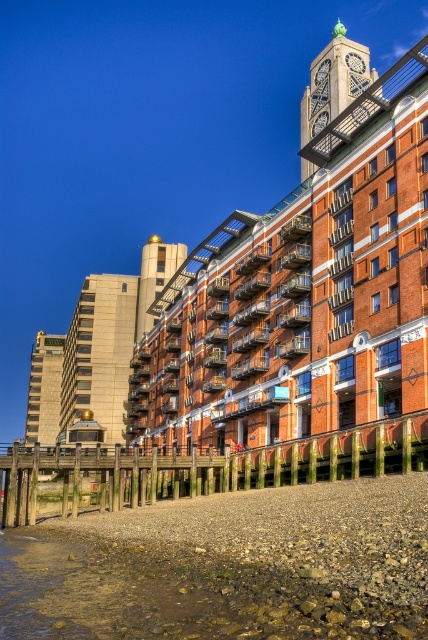
You are standing on the wooden pier in the foreground of the waterfront scene. You want to take a photo of the brick building at center from a distance of exactly 200 feet. Is the current position on the pier suitable for taking this photo?

The brick building at center is currently 200.79 feet away from the viewer. Since this is slightly more than 200 feet, you would need to move about 0.79 feet closer to the brick building at center to achieve the desired distance of exactly 200 feet.

Based on the photo, you are standing on the wooden pier and want to walk towards the red brick building with the clock tower. Which point, point (91, 419) or point (29, 404), is closer to the building?

Point (91, 419) is closer to the building because it is in front of point (29, 404), which is further away from the building.